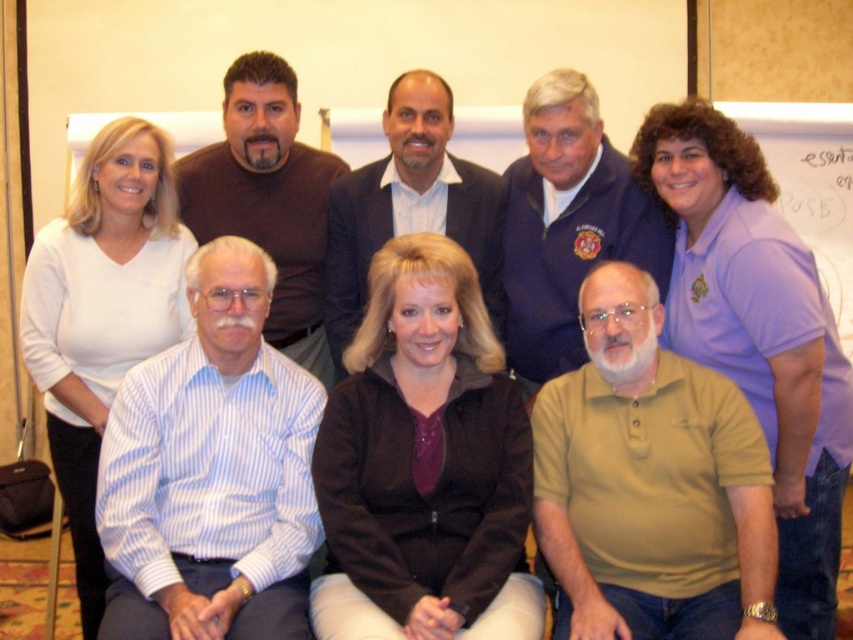
You are standing in the conference room and see the blue fleece jacket at upper center. If you were to draw a straight line from your current position to the jacket, what coordinate would it reach at the halfway point?

The halfway point between your current position and the blue fleece jacket at upper center would be at coordinate point calculated by averaging the coordinates of your position and the jacket. Since the jacket is at point (567, 224), the halfway point would be halfway between your starting point and this coordinate.